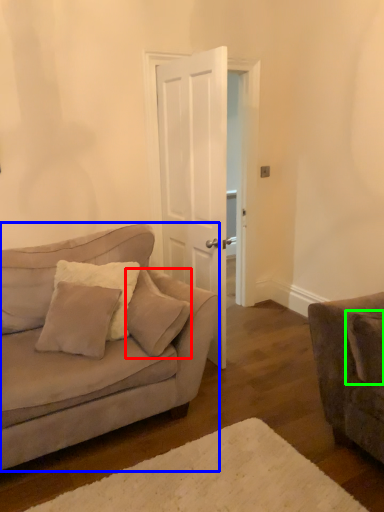
Question: Which object is the farthest from pillow (highlighted by a red box)? Choose among these: studio couch (highlighted by a blue box) or pillow (highlighted by a green box).

Choices:
 (A) studio couch
 (B) pillow

Answer: (B)